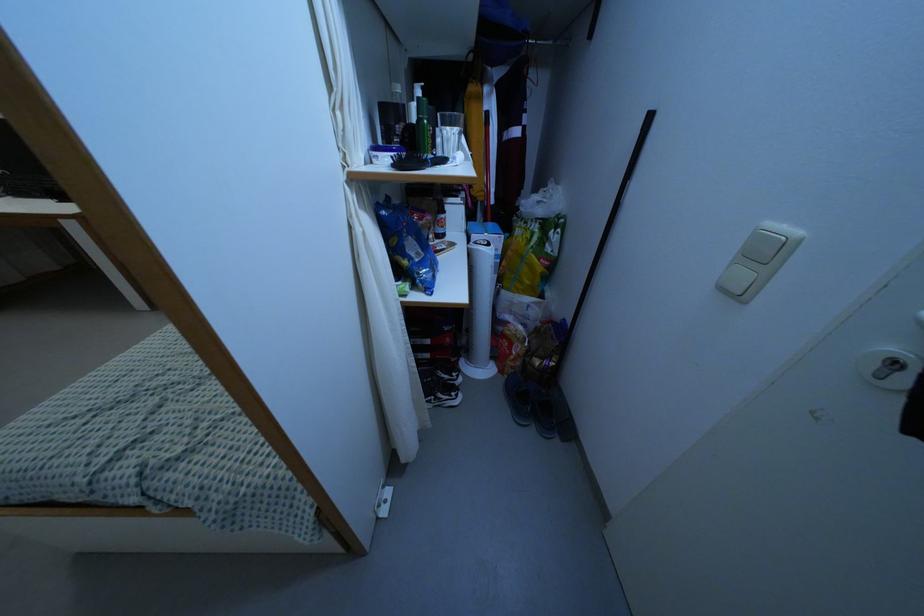
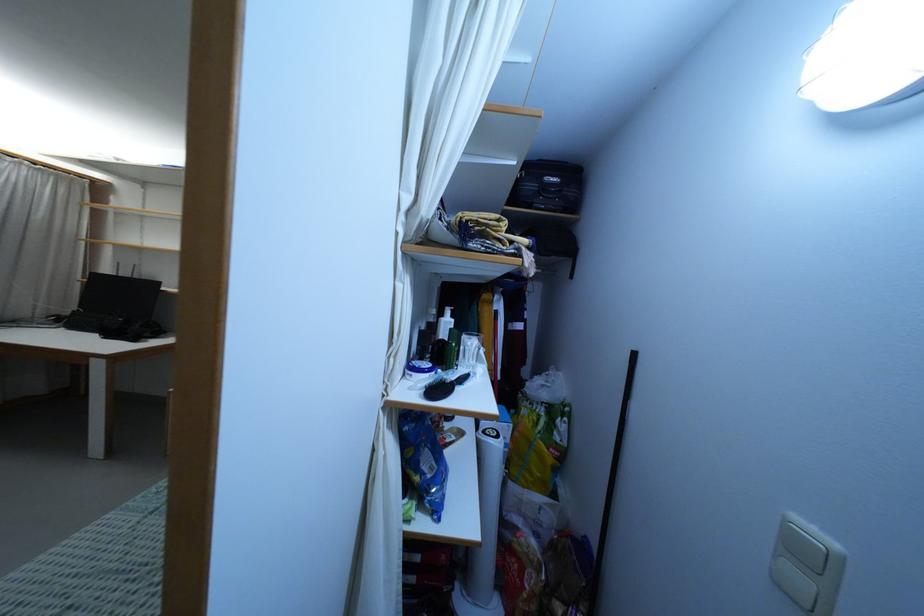
Locate, in the second image, the point that corresponds to [409,257] in the first image.

(422, 474)